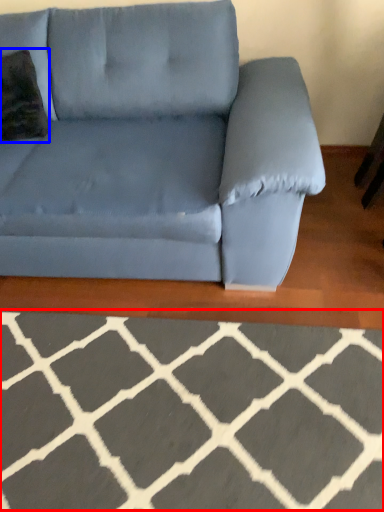
Question: Among these objects, which one is farthest to the camera, furniture (highlighted by a red box) or throw pillow (highlighted by a blue box)?

Choices:
 (A) furniture
 (B) throw pillow

Answer: (B)